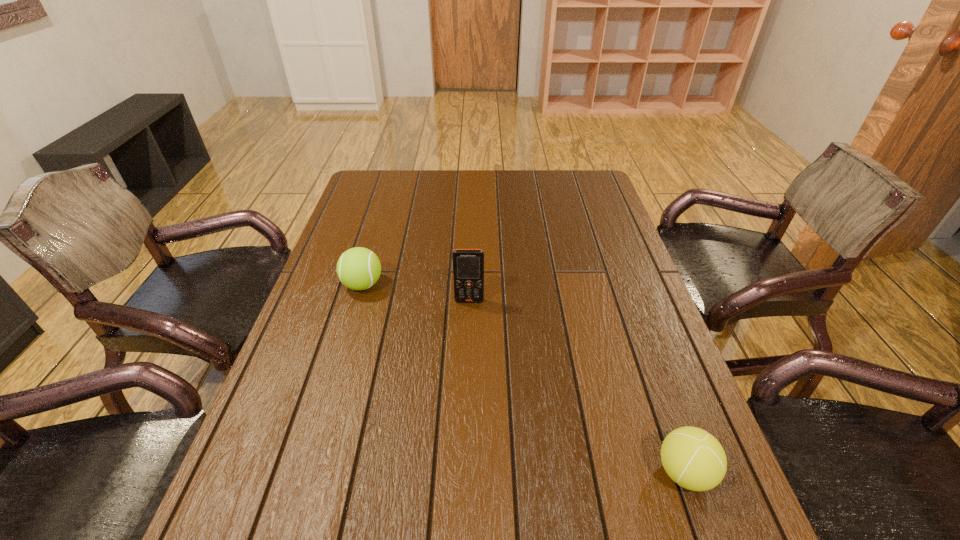
The width and height of the screenshot is (960, 540). Identify the location of object present at the right edge. (694, 459).

Locate an element on the screen. The height and width of the screenshot is (540, 960). vacant area at the far edge of the desktop is located at coordinates 531,200.

Locate an element on the screen. The image size is (960, 540). vacant space at the right edge of the desktop is located at coordinates point(654,308).

The image size is (960, 540). In order to click on vacant region at the far left corner in this screenshot , I will do `click(404, 171)`.

Where is `vacant space in between the cellular telephone and the farther tennis ball`? Image resolution: width=960 pixels, height=540 pixels. vacant space in between the cellular telephone and the farther tennis ball is located at coordinates (x=416, y=293).

Find the location of a particular element. vacant space that's between the cellular telephone and the nearer tennis ball is located at coordinates (577, 387).

Image resolution: width=960 pixels, height=540 pixels. Identify the location of vacant point located between the tallest object and the leftmost object. (416, 293).

Where is `free spot between the tallest object and the nearer tennis ball`? The width and height of the screenshot is (960, 540). free spot between the tallest object and the nearer tennis ball is located at coordinates [x=577, y=387].

The height and width of the screenshot is (540, 960). Find the location of `empty space that is in between the cellular telephone and the rightmost object`. empty space that is in between the cellular telephone and the rightmost object is located at coordinates (577, 387).

You are a GUI agent. You are given a task and a screenshot of the screen. Output one action in this format:
    pyautogui.click(x=<x>, y=<y>)
    Task: Click on the unoccupied position between the right tennis ball and the tallest object
    The width and height of the screenshot is (960, 540).
    Given the screenshot: What is the action you would take?
    (577, 387)